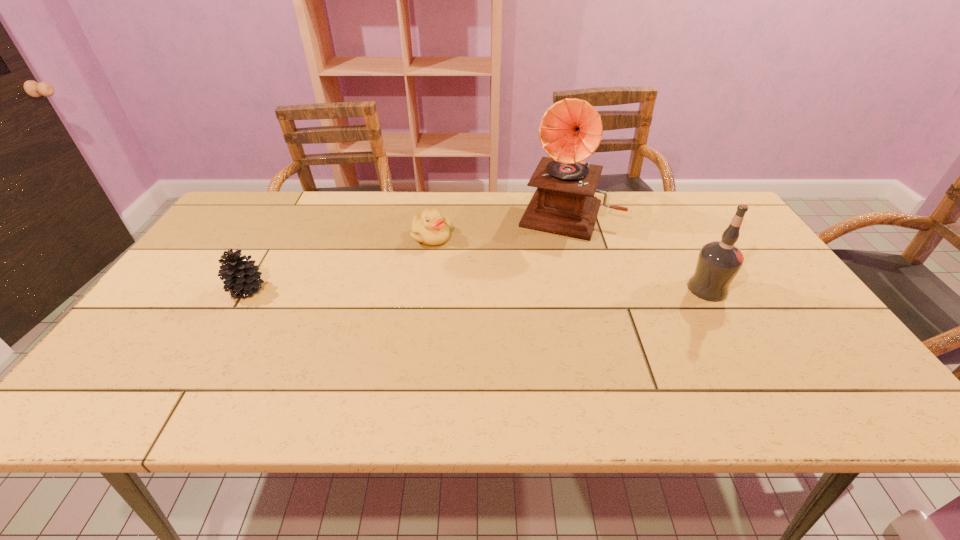
I want to click on vacant area located 0.340m on the horn of the tallest object, so click(x=527, y=317).

Where is `vacant position located on the horn of the tallest object`? This screenshot has height=540, width=960. vacant position located on the horn of the tallest object is located at coordinates (534, 298).

Image resolution: width=960 pixels, height=540 pixels. Identify the location of vacant space located on the horn of the tallest object. (530, 308).

Locate an element on the screen. free region located on the beak of the shortest object is located at coordinates pos(442,278).

Image resolution: width=960 pixels, height=540 pixels. What are the coordinates of `free space located 0.200m on the beak of the shortest object` in the screenshot? It's located at coord(445,293).

At what (x,y) coordinates should I click in order to perform the action: click on blank space located 0.060m on the beak of the shortest object. Please return your answer as a coordinate pair (x, y). The image size is (960, 540). Looking at the image, I should click on (438, 260).

The image size is (960, 540). What are the coordinates of `phonograph record present at the far edge` in the screenshot? It's located at (570, 131).

The width and height of the screenshot is (960, 540). I want to click on duckling situated at the far edge, so click(x=430, y=228).

You are a GUI agent. You are given a task and a screenshot of the screen. Output one action in this format:
    pyautogui.click(x=<x>, y=<y>)
    Task: Click on the object that is at the left edge
    The image size is (960, 540).
    Given the screenshot: What is the action you would take?
    pyautogui.click(x=242, y=278)

At what (x,y) coordinates should I click in order to perform the action: click on blank area at the far edge. Please return your answer as a coordinate pair (x, y). Looking at the image, I should click on (665, 195).